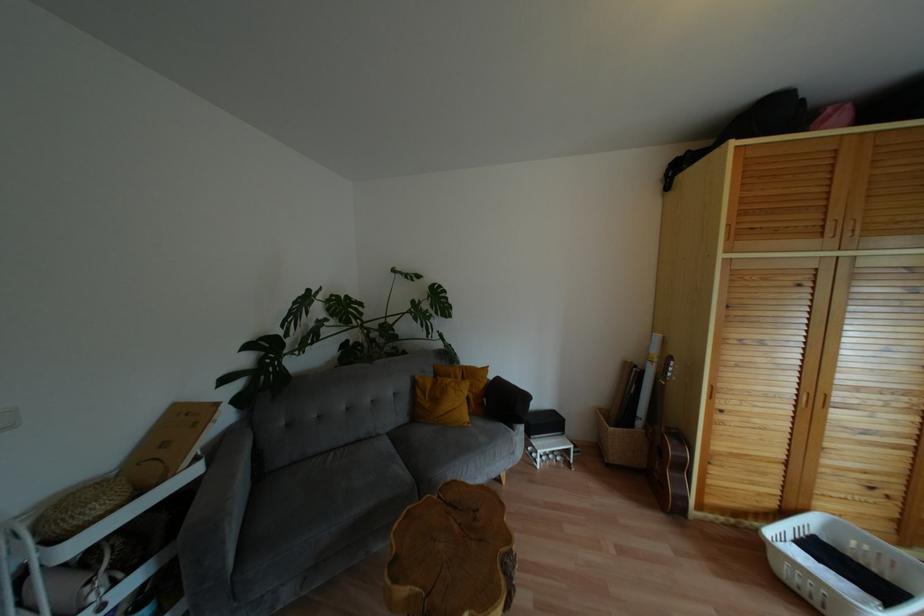
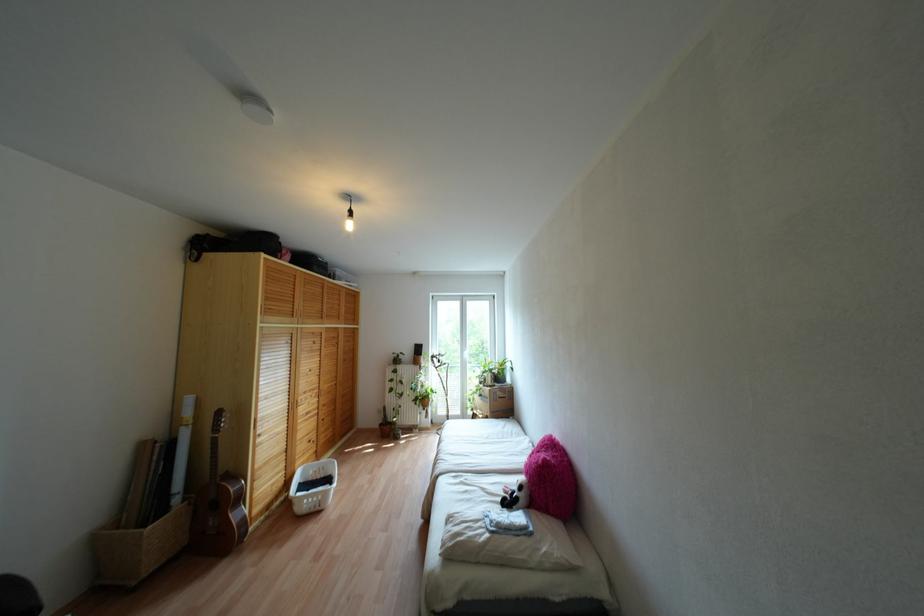
Question: I am providing you with two images of the same scene from different viewpoints. Please identify which objects are invisible in image2.

Choices:
 (A) white pillow
 (B) potted plant
 (C) louvered cabinet door
 (D) none of these

Answer: (D)